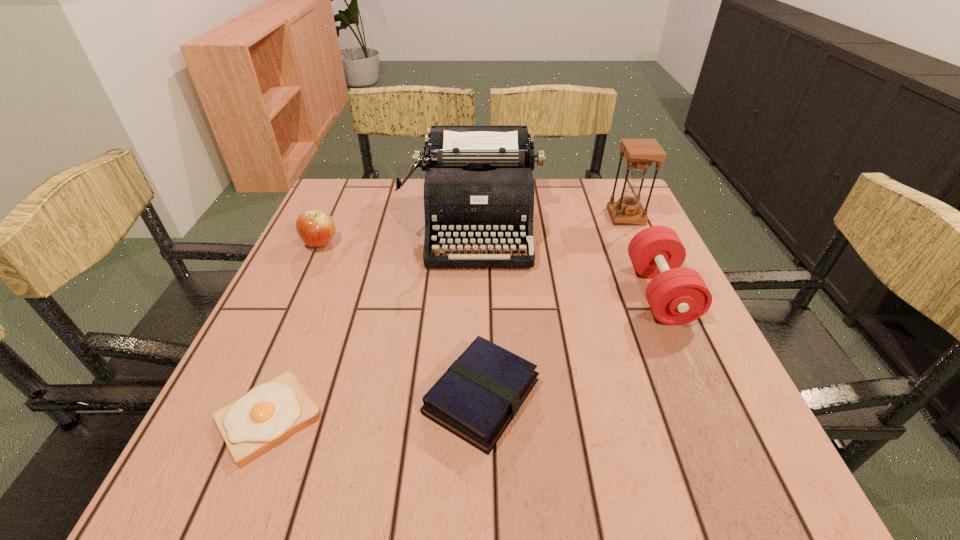
The height and width of the screenshot is (540, 960). What are the coordinates of `object positioned at the near left corner` in the screenshot? It's located at (269, 413).

This screenshot has width=960, height=540. Find the location of `object located in the far right corner section of the desktop`. object located in the far right corner section of the desktop is located at coordinates (640, 153).

The image size is (960, 540). In the image, there is a desktop. In order to click on vacant space at the far edge in this screenshot , I will do `click(540, 183)`.

Where is `free space at the near edge`? free space at the near edge is located at coordinates (502, 481).

You are a GUI agent. You are given a task and a screenshot of the screen. Output one action in this format:
    pyautogui.click(x=<x>, y=<y>)
    Task: Click on the vacant position at the left edge of the desktop
    This screenshot has width=960, height=540.
    Given the screenshot: What is the action you would take?
    pyautogui.click(x=288, y=296)

Locate an element on the screen. The image size is (960, 540). vacant space at the right edge of the desktop is located at coordinates (720, 364).

Where is `vacant space at the near left corner of the desktop`? vacant space at the near left corner of the desktop is located at coordinates (235, 463).

You are a GUI agent. You are given a task and a screenshot of the screen. Output one action in this format:
    pyautogui.click(x=<x>, y=<y>)
    Task: Click on the vacant region at the far right corner
    
    Given the screenshot: What is the action you would take?
    pyautogui.click(x=614, y=200)

The width and height of the screenshot is (960, 540). In the image, there is a desktop. In order to click on vacant space at the near right corner in this screenshot , I will do `click(682, 487)`.

The height and width of the screenshot is (540, 960). In order to click on vacant space that's between the hourglass and the shortest object in this screenshot , I will do `click(447, 318)`.